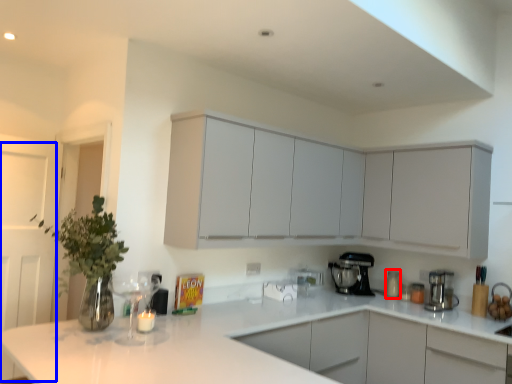
Question: Which object appears farthest to the camera in this image, appliance (highlighted by a red box) or glass door (highlighted by a blue box)?

Choices:
 (A) appliance
 (B) glass door

Answer: (A)